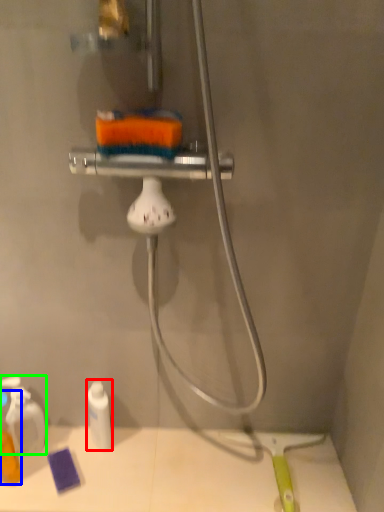
Question: Based on their relative distances, which object is farther from toiletry (highlighted by a red box)? Choose from toiletry (highlighted by a blue box) and toiletry (highlighted by a green box).

Choices:
 (A) toiletry
 (B) toiletry

Answer: (A)